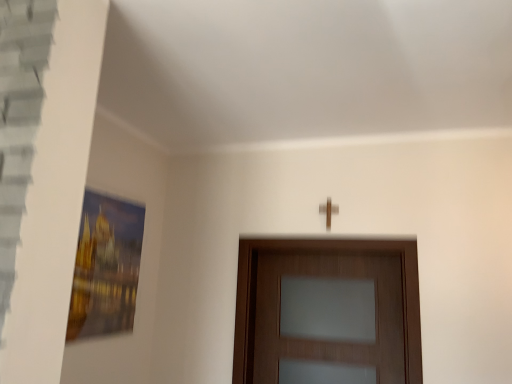
The image size is (512, 384). What do you see at coordinates (328, 211) in the screenshot?
I see `wooden cross at upper center` at bounding box center [328, 211].

Find the location of a particular element. wooden cross at upper center is located at coordinates [x=328, y=211].

The image size is (512, 384). Describe the element at coordinates (324, 276) in the screenshot. I see `wooden door at center` at that location.

You are a GUI agent. You are given a task and a screenshot of the screen. Output one action in this format:
    pyautogui.click(x=<x>, y=<y>)
    Task: Click on the wooden door at center
    Image resolution: width=512 pixels, height=384 pixels.
    Given the screenshot: What is the action you would take?
    [324, 276]

I want to click on wooden cross at upper center, so (328, 211).

Does wooden door at center appear on the left side of wooden cross at upper center?

Yes.

Relative to wooden cross at upper center, is wooden door at center in front or behind?

In the image, wooden door at center appears in front of wooden cross at upper center.

Which point is more forward, (252, 257) or (322, 208)?

The point (322, 208) is closer.

From the image's perspective, between wooden door at center and wooden cross at upper center, which one is located above?

From the image's view, wooden cross at upper center is above.

From a real-world perspective, is wooden door at center positioned above or below wooden cross at upper center?

wooden door at center is situated lower than wooden cross at upper center in the real world.

Considering the sizes of objects wooden door at center and wooden cross at upper center in the image provided, who is thinner, wooden door at center or wooden cross at upper center?

wooden cross at upper center is thinner.

Which of these two, wooden door at center or wooden cross at upper center, stands shorter?

Standing shorter between the two is wooden cross at upper center.

Is wooden door at center bigger or smaller than wooden cross at upper center?

Clearly, wooden door at center is larger in size than wooden cross at upper center.

Would you say wooden cross at upper center is part of wooden door at center's contents?

Definitely not — wooden cross at upper center is not inside wooden door at center.

Is wooden door at center next to wooden cross at upper center and touching it?

No, wooden door at center is not next to wooden cross at upper center.

Consider the image. Could you tell me if wooden door at center is turned towards wooden cross at upper center?

No.

The height and width of the screenshot is (384, 512). I want to click on door located on the left of wooden cross at upper center, so click(x=324, y=276).

Which is more to the left, wooden cross at upper center or wooden door at center?

wooden door at center.

Is the depth of wooden cross at upper center greater than that of wooden door at center?

Yes, wooden cross at upper center is behind wooden door at center.

Which point is more forward, (335, 213) or (408, 320)?

The point (408, 320) is closer to the camera.

From the image's perspective, is wooden cross at upper center positioned above or below wooden door at center?

From the image's perspective, wooden cross at upper center appears above wooden door at center.

From a real-world perspective, is wooden cross at upper center physically below wooden door at center?

No, from a real-world perspective, wooden cross at upper center is not below wooden door at center.

Does wooden cross at upper center have a lesser width compared to wooden door at center?

Yes.

Does wooden cross at upper center have a greater height compared to wooden door at center?

Incorrect, the height of wooden cross at upper center is not larger of that of wooden door at center.

Consider the image. Does wooden cross at upper center have a larger size compared to wooden door at center?

Actually, wooden cross at upper center might be smaller than wooden door at center.

Is wooden cross at upper center inside or outside of wooden door at center?

wooden cross at upper center is not inside wooden door at center, it's outside.

Is wooden cross at upper center next to wooden door at center and touching it?

No, wooden cross at upper center is not next to wooden door at center.

Could you tell me if wooden cross at upper center is facing wooden door at center?

No, wooden cross at upper center is not oriented towards wooden door at center.

How distant is wooden cross at upper center from wooden door at center?

A distance of 19.90 inches exists between wooden cross at upper center and wooden door at center.

Where is `door handle on the right of the wooden door at center`? This screenshot has width=512, height=384. door handle on the right of the wooden door at center is located at coordinates (328, 211).

You are a GUI agent. You are given a task and a screenshot of the screen. Output one action in this format:
    pyautogui.click(x=<x>, y=<y>)
    Task: Click on the door below the wooden cross at upper center (from the image's perspective)
    This screenshot has width=512, height=384.
    Given the screenshot: What is the action you would take?
    pyautogui.click(x=324, y=276)

This screenshot has width=512, height=384. Identify the location of door handle that is on the right side of wooden door at center. (328, 211).